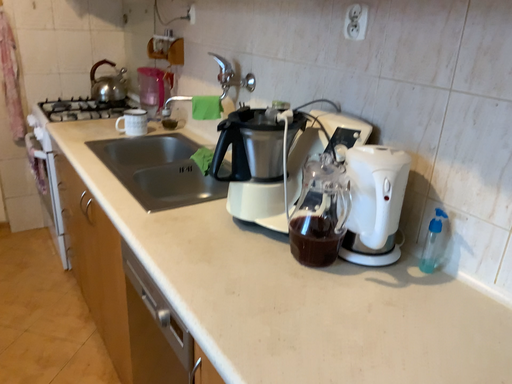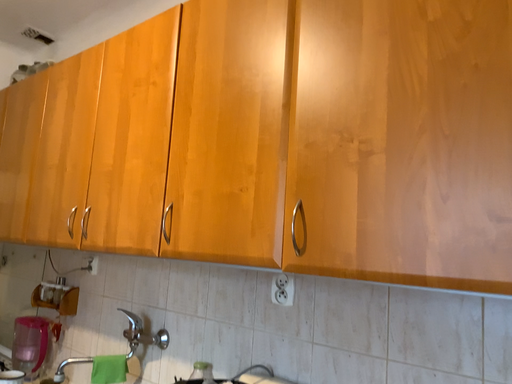
Question: Which way did the camera rotate in the video?

Choices:
 (A) rotated downward
 (B) rotated upward

Answer: (B)